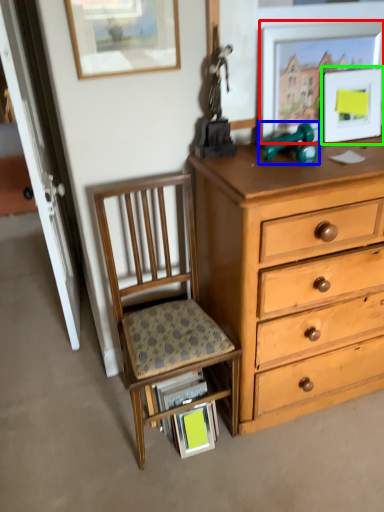
Question: Which object is the farthest from picture frame (highlighted by a red box)? Choose among these: toy (highlighted by a blue box) or picture frame (highlighted by a green box).

Choices:
 (A) toy
 (B) picture frame

Answer: (A)